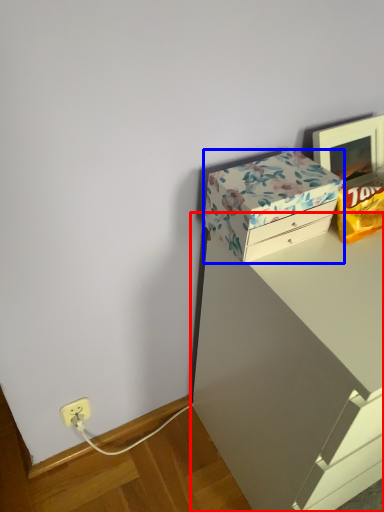
Question: Which point is further to the camera, vanity (highlighted by a red box) or box (highlighted by a blue box)?

Choices:
 (A) vanity
 (B) box

Answer: (B)